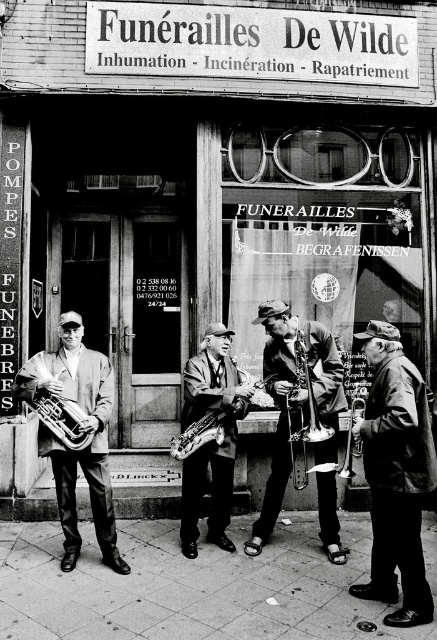
Who is higher up, leather jacket at right or smooth leather jacket at center?

smooth leather jacket at center is above.

Is leather jacket at right below smooth leather jacket at center?

Indeed, leather jacket at right is positioned under smooth leather jacket at center.

Image resolution: width=437 pixels, height=640 pixels. In order to click on leather jacket at right in this screenshot , I will do `click(395, 476)`.

Is brass tuba at left shorter than satin saxophone at center?

Correct, brass tuba at left is not as tall as satin saxophone at center.

Does brass tuba at left have a greater width compared to satin saxophone at center?

Incorrect, brass tuba at left's width does not surpass satin saxophone at center's.

Between point (83, 432) and point (193, 440), which one is positioned behind?

The point (193, 440) is more distant.

Where is `brass tuba at left`? The image size is (437, 640). brass tuba at left is located at coordinates 63,419.

Who is more forward, (x=201, y=426) or (x=351, y=477)?

Point (x=351, y=477) is in front.

Is satin saxophone at center above brass shiny trumpet at center?

Correct, satin saxophone at center is located above brass shiny trumpet at center.

The image size is (437, 640). Find the location of `satin saxophone at center`. satin saxophone at center is located at coordinates (198, 435).

You are a GUI agent. You are given a task and a screenshot of the screen. Output one action in this format:
    pyautogui.click(x=<x>, y=<y>)
    Task: Click on the satin saxophone at center
    
    Given the screenshot: What is the action you would take?
    pyautogui.click(x=198, y=435)